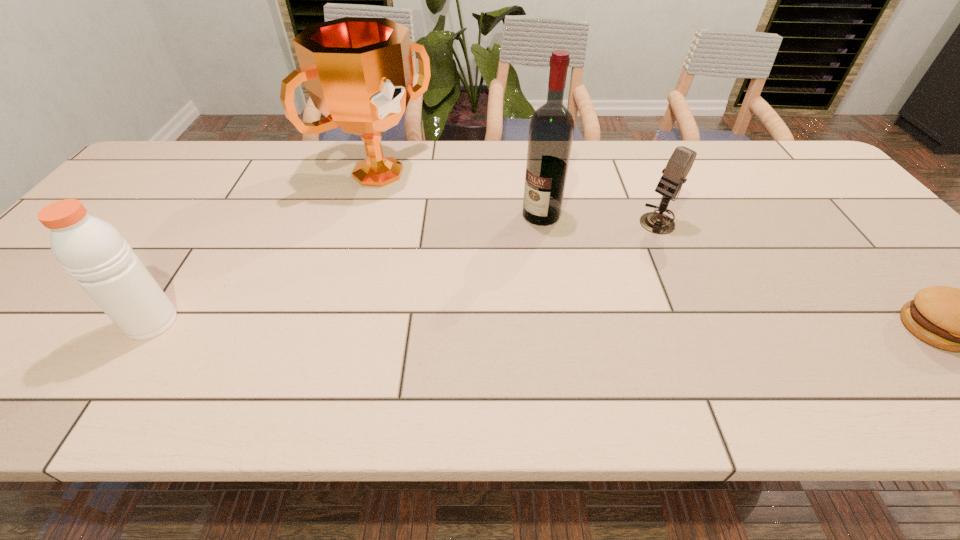
Locate an element on the screen. This screenshot has width=960, height=540. vacant space on the desktop that is between the leftmost object and the rightmost object and is positioned on the front and back of the third object from right to left is located at coordinates (424, 325).

Locate an element on the screen. free space on the desktop that is between the shaker and the rightmost object and is positioned on the front-facing side of the microphone is located at coordinates (505, 325).

What are the coordinates of `free space on the desktop that is between the leftmost object and the shortest object and is positioned on the side of the second object from left to right with the star emblem` in the screenshot? It's located at (572, 326).